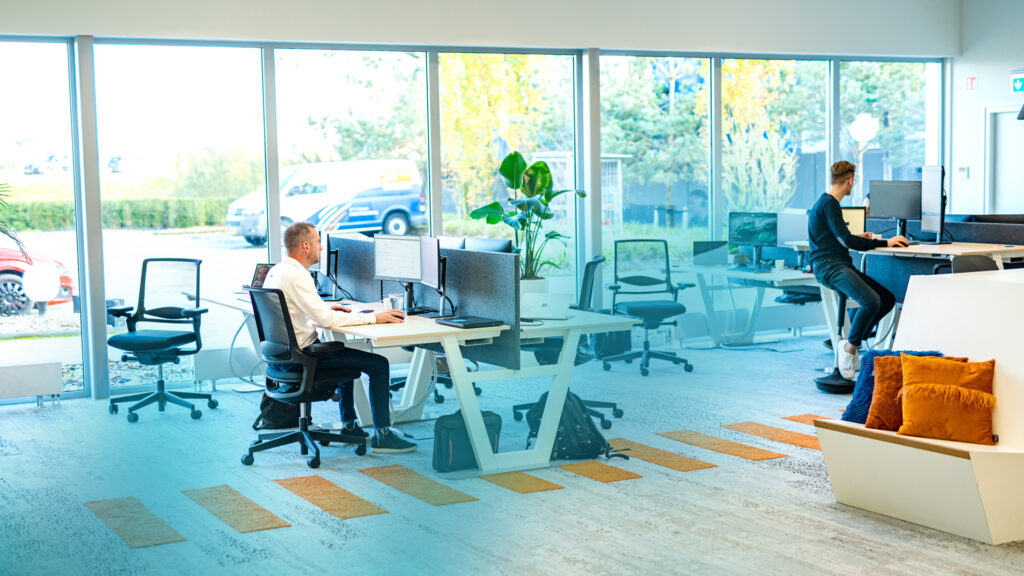
You are a GUI agent. You are given a task and a screenshot of the screen. Output one action in this format:
    pyautogui.click(x=<x>, y=<y>)
    Task: Click on the windows on the wall
    
    Given the screenshot: What is the action you would take?
    pyautogui.click(x=884, y=113), pyautogui.click(x=799, y=134), pyautogui.click(x=654, y=142), pyautogui.click(x=520, y=135), pyautogui.click(x=382, y=127), pyautogui.click(x=151, y=131), pyautogui.click(x=53, y=168)